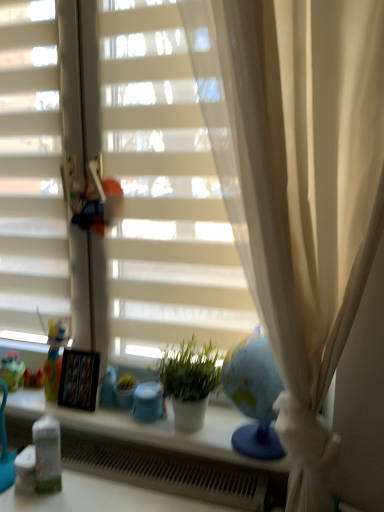
This screenshot has height=512, width=384. Find the location of `free space above white plastic radiator at lower center (from a real-world perspective)`. free space above white plastic radiator at lower center (from a real-world perspective) is located at coordinates (104, 448).